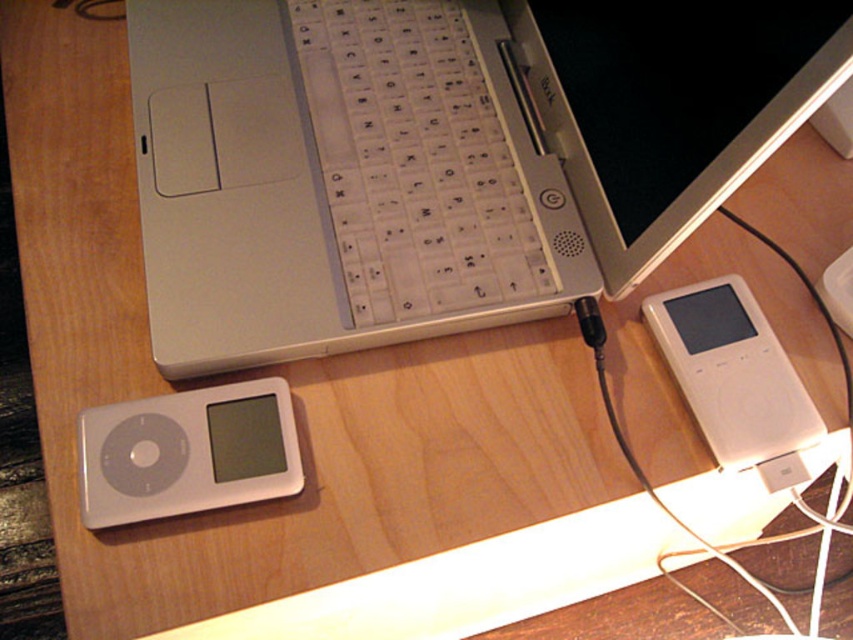
Question: Among these points, which one is nearest to the camera?

Choices:
 (A) (363, 259)
 (B) (671, 336)

Answer: (B)

Question: Where is white glossy ipod at lower left located in relation to white plastic ipod at right in the image?

Choices:
 (A) right
 (B) left

Answer: (B)

Question: Which point appears closest to the camera in this image?

Choices:
 (A) (106, 476)
 (B) (343, 16)
 (C) (671, 333)

Answer: (A)

Question: Is white plastic keyboard at center smaller than white plastic ipod at right?

Choices:
 (A) no
 (B) yes

Answer: (A)

Question: Does white plastic keyboard at center have a greater width compared to white glossy ipod at lower left?

Choices:
 (A) yes
 (B) no

Answer: (A)

Question: Among these objects, which one is nearest to the camera?

Choices:
 (A) white plastic ipod at right
 (B) white plastic keyboard at center

Answer: (A)